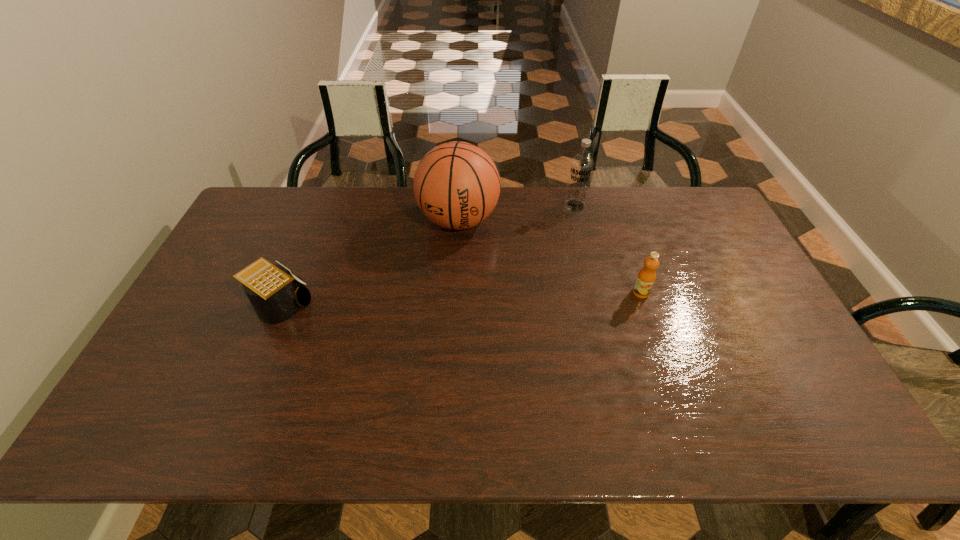
Image resolution: width=960 pixels, height=540 pixels. Find the location of `free space at the far left corner`. free space at the far left corner is located at coordinates (263, 195).

The width and height of the screenshot is (960, 540). Find the location of `free space at the far right corner`. free space at the far right corner is located at coordinates (704, 220).

I want to click on vacant space at the near right corner of the desktop, so click(761, 372).

Where is `vacant area between the leftmost object and the third tallest object`? vacant area between the leftmost object and the third tallest object is located at coordinates (461, 299).

Locate an element on the screen. Image resolution: width=960 pixels, height=540 pixels. free space that is in between the third object from left to right and the basketball is located at coordinates (516, 213).

Where is `unoccupied area between the leftmost object and the vodka`? This screenshot has width=960, height=540. unoccupied area between the leftmost object and the vodka is located at coordinates (427, 255).

Find the location of `free spot between the second object from right to left and the leftmost object`. free spot between the second object from right to left and the leftmost object is located at coordinates (427, 255).

What are the coordinates of `free area in between the third object from left to right and the orange juice` in the screenshot? It's located at (608, 249).

Locate an element on the screen. vacant space in between the basketball and the rightmost object is located at coordinates (550, 256).

Where is `unoccupied area between the orange juice and the second object from right to left`? unoccupied area between the orange juice and the second object from right to left is located at coordinates (608, 249).